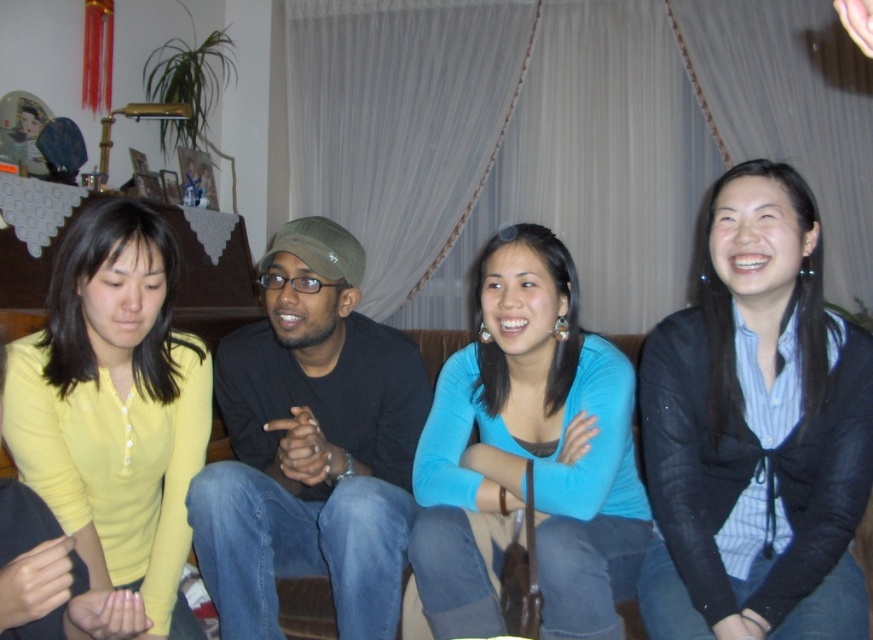
Is black matte shirt at center wider than blue matte shirt at center?

No.

Does black matte shirt at center appear under blue matte shirt at center?

Yes.

Identify the location of black matte shirt at center. (310, 445).

Who is positioned more to the right, black matte shirt at center or yellow matte shirt at lower left?

Positioned to the right is black matte shirt at center.

Does black matte shirt at center lie behind yellow matte shirt at lower left?

Yes.

Between point (355, 636) and point (70, 272), which one is positioned behind?

The point (355, 636) is more distant.

The image size is (873, 640). What are the coordinates of `black matte shirt at center` in the screenshot? It's located at (310, 445).

Consider the image. Can you confirm if matte black jacket at lower right is smaller than blue matte shirt at center?

Yes.

Looking at this image, which is more to the left, matte black jacket at lower right or blue matte shirt at center?

blue matte shirt at center

Locate an element on the screen. The width and height of the screenshot is (873, 640). matte black jacket at lower right is located at coordinates (755, 432).